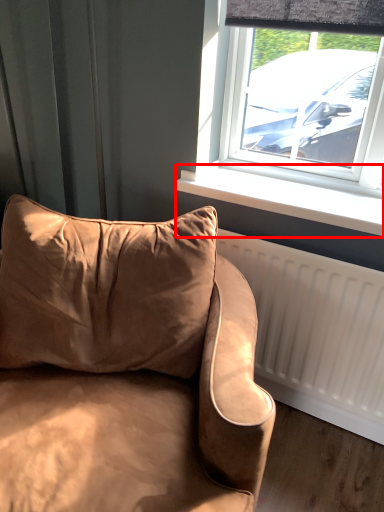
Question: From the image's perspective, considering the relative positions of window sill (annotated by the red box) and studio couch in the image provided, where is window sill (annotated by the red box) located with respect to the staircase?

Choices:
 (A) below
 (B) above

Answer: (B)